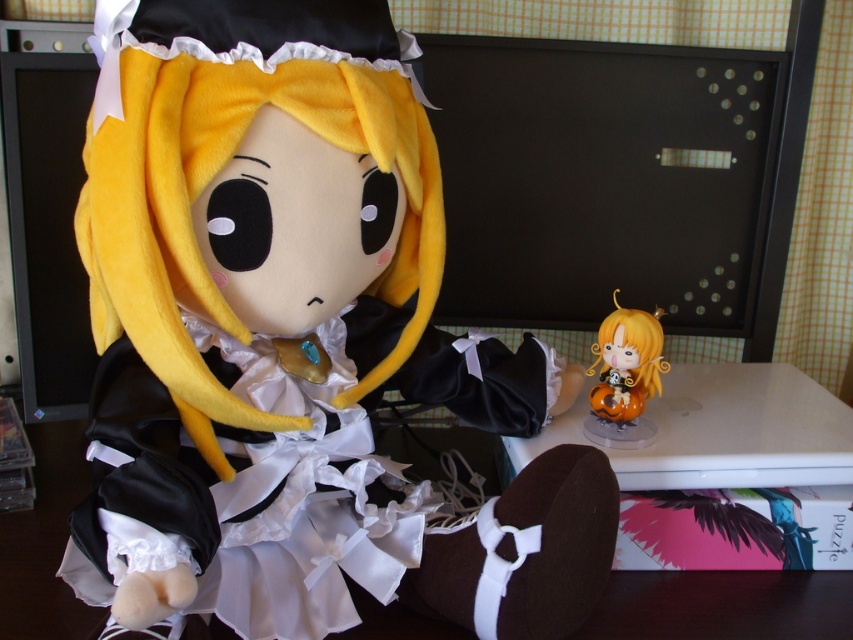
What are the coordinates of the soft plush doll at center?

The coordinates of the soft plush doll at center are at point (294, 339).

Please describe the exact location of the soft plush doll at center in the image using coordinates. The coordinate system has the origin at the bottom left corner of the image, with the x and y axes increasing to the right and up respectively.

The soft plush doll at center is located at coordinates approximately at point (294, 339).

You are organizing a display shelf and need to place the soft plush doll at center and the matte orange figurine at center. Since you want to highlight the larger one, which should be placed in the center of the shelf?

The soft plush doll at center is larger than the matte orange figurine at center, so it should be placed in the center of the shelf to highlight its size.